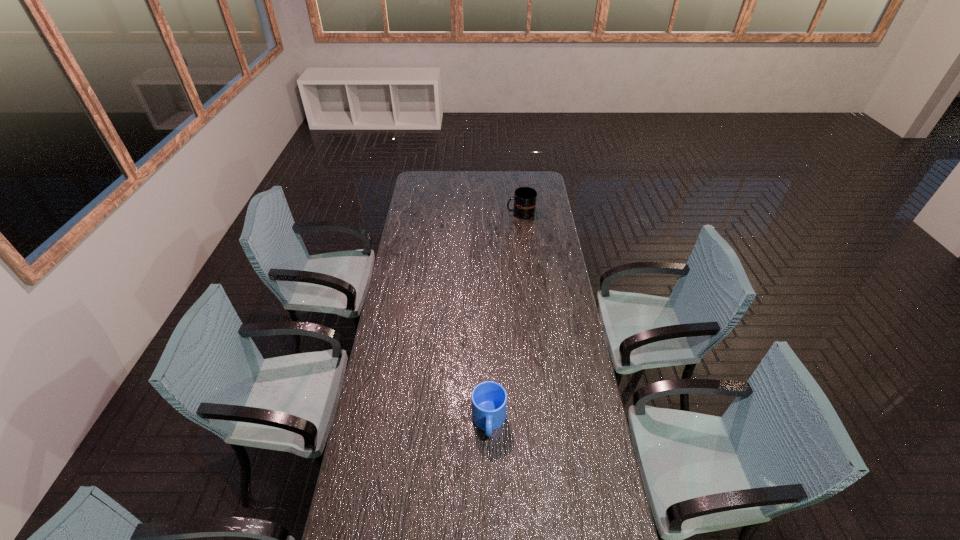
Identify the location of free space at the left edge. This screenshot has width=960, height=540. (389, 407).

What are the coordinates of `free space at the right edge of the desktop` in the screenshot? It's located at (593, 538).

The width and height of the screenshot is (960, 540). I want to click on free space between the nearer object and the right object, so click(505, 318).

Locate an element on the screen. This screenshot has width=960, height=540. vacant space that satisfies the following two spatial constraints: 1. with the handle on the side of the right object; 2. on the side of the nearer object with the handle is located at coordinates (545, 421).

Locate an element on the screen. This screenshot has width=960, height=540. vacant space that satisfies the following two spatial constraints: 1. with the handle on the side of the farther object; 2. on the side of the left mug with the handle is located at coordinates (545, 421).

At what (x,y) coordinates should I click in order to perform the action: click on vacant area in the image that satisfies the following two spatial constraints: 1. with the handle on the side of the right mug; 2. on the side of the nearer mug with the handle. Please return your answer as a coordinate pair (x, y). Looking at the image, I should click on (545, 421).

Locate an element on the screen. This screenshot has width=960, height=540. blank area in the image that satisfies the following two spatial constraints: 1. with the handle on the side of the right mug; 2. on the side of the nearer mug with the handle is located at coordinates (545, 421).